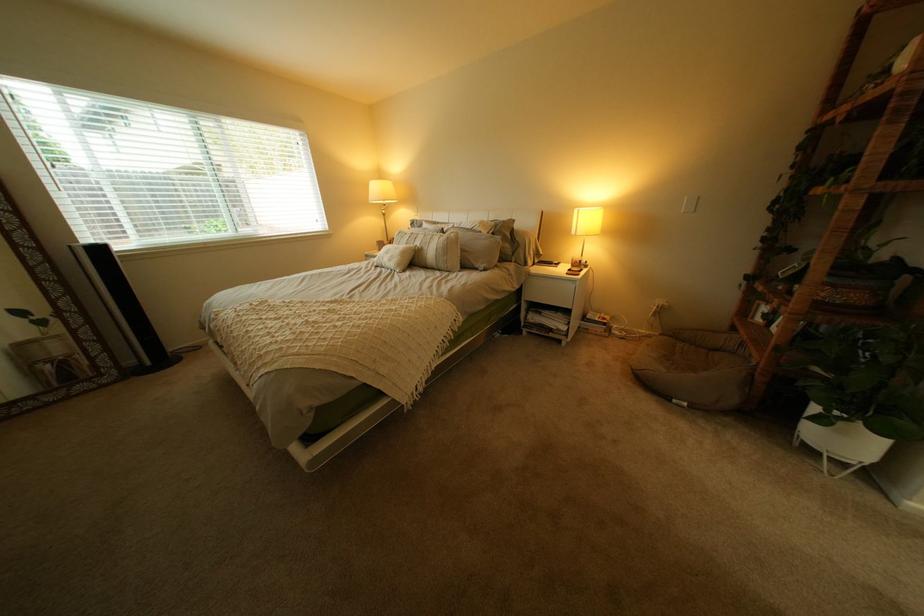
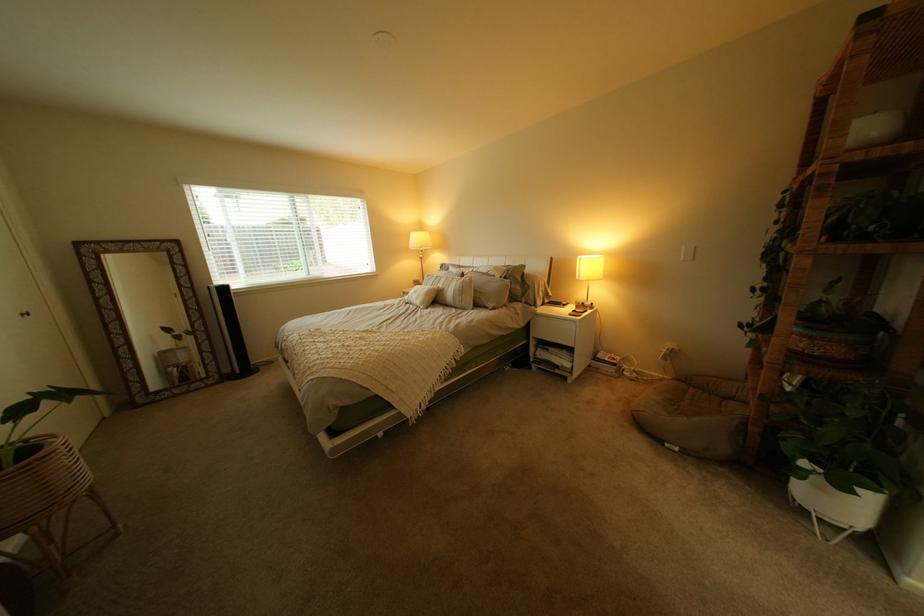
Locate, in the second image, the point that corresponds to [586,273] in the first image.

(590, 314)